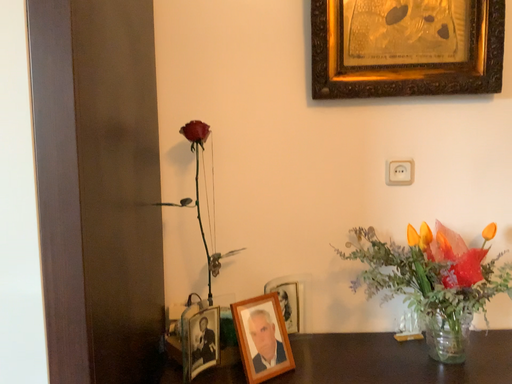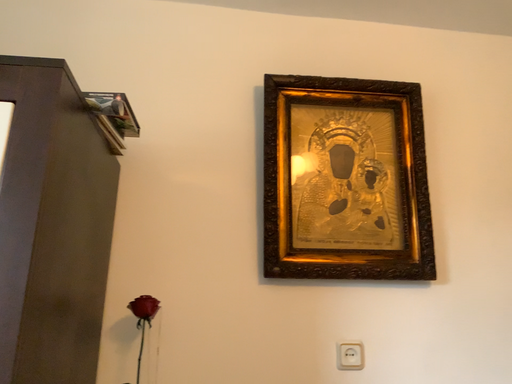
Question: How did the camera likely rotate when shooting the video?

Choices:
 (A) rotated downward
 (B) rotated upward

Answer: (B)